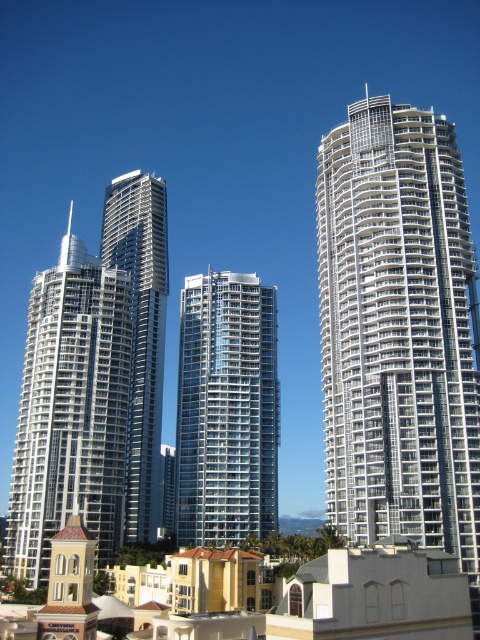
You are standing at the point marked by the coordinates point (227, 410) in the image. Based on the scene description, what type of building are you facing?

The point (227, 410) indicates a glassy steel building at center, so you are facing a glassy steel building at center.

You are standing in front of the cluster of modern high rise buildings and want to determine the relative positions of two points marked in the image. Which point is closer to you, point [410,291] or point [93,416]?

Point [410,291] is closer to the viewer than point [93,416].

You are standing at the point with coordinates (397,330) in the image of the city. Which building are you facing? Please answer with the exact label from the objects list.

The point at (397,330) corresponds to the white glass building at center, so you are facing the white glass building at center.